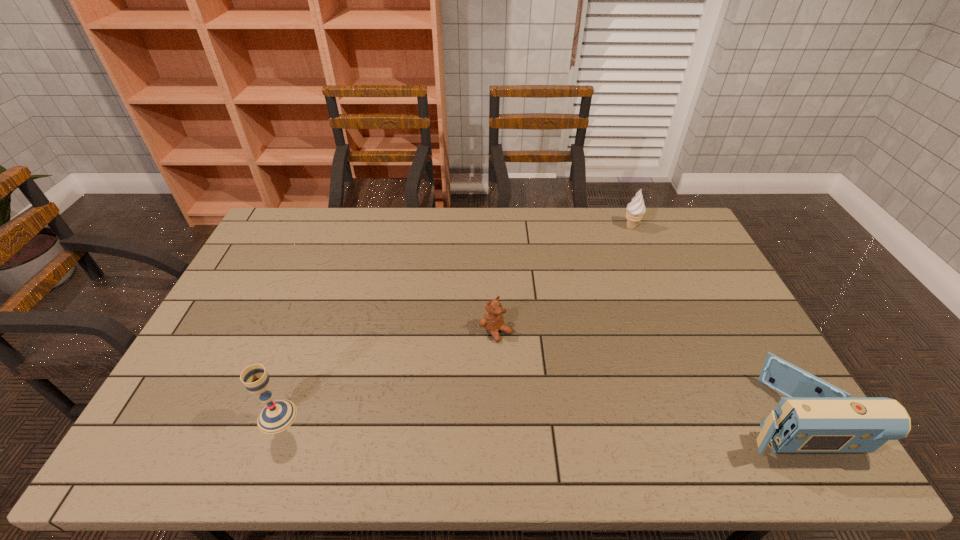
The height and width of the screenshot is (540, 960). I want to click on empty location between the leftmost object and the teddy bear, so click(x=387, y=374).

Locate an element on the screen. The height and width of the screenshot is (540, 960). empty space that is in between the camcorder and the third object from right to left is located at coordinates (642, 373).

Find the location of `vacant area that lies between the second farthest object and the chalice`. vacant area that lies between the second farthest object and the chalice is located at coordinates (387, 374).

This screenshot has height=540, width=960. I want to click on unoccupied position between the third nearest object and the rightmost object, so click(x=642, y=373).

I want to click on object that is the nearest to the icecream, so click(x=493, y=321).

At what (x,y) coordinates should I click in order to perform the action: click on object that is the closest to the leftmost object. Please return your answer as a coordinate pair (x, y). The height and width of the screenshot is (540, 960). Looking at the image, I should click on (493, 321).

You are a GUI agent. You are given a task and a screenshot of the screen. Output one action in this format:
    pyautogui.click(x=<x>, y=<y>)
    Task: Click on the vacant area that satisfies the following two spatial constraints: 1. on the front side of the camcorder; 2. on the side of the shortest object with the flip-out screen
    
    Given the screenshot: What is the action you would take?
    pyautogui.click(x=498, y=416)

Locate an element on the screen. Image resolution: width=960 pixels, height=540 pixels. vacant space that satisfies the following two spatial constraints: 1. on the back side of the teddy bear; 2. on the left side of the chalice is located at coordinates (309, 331).

Locate an element on the screen. The width and height of the screenshot is (960, 540). vacant position in the image that satisfies the following two spatial constraints: 1. on the front side of the shortest object; 2. on the side of the rightmost object with the flip-out screen is located at coordinates (498, 416).

Find the location of `vacant area in the image that satisfies the following two spatial constraints: 1. on the front side of the teddy bear; 2. on the side of the rightmost object with the flip-out screen`. vacant area in the image that satisfies the following two spatial constraints: 1. on the front side of the teddy bear; 2. on the side of the rightmost object with the flip-out screen is located at coordinates (498, 416).